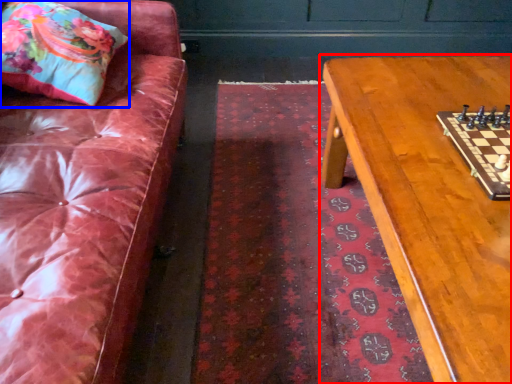
Question: Which object appears farthest to the camera in this image, table (highlighted by a red box) or throw pillow (highlighted by a blue box)?

Choices:
 (A) table
 (B) throw pillow

Answer: (B)